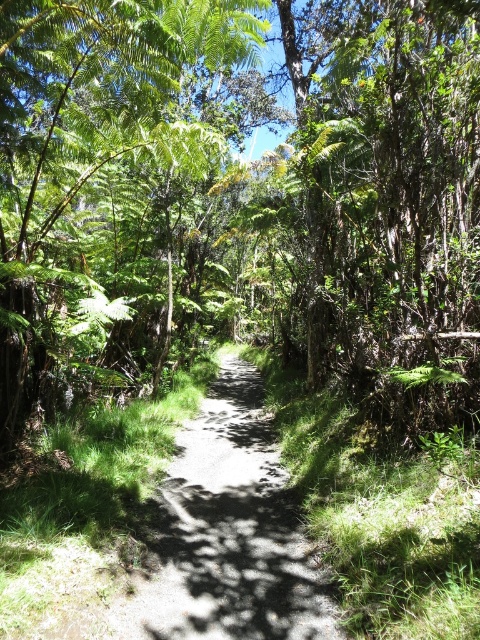
Question: Is green leafy tree at center to the left of dirt path at center from the viewer's perspective?

Choices:
 (A) no
 (B) yes

Answer: (B)

Question: Which object appears closest to the camera in this image?

Choices:
 (A) dirt path at center
 (B) green leafy tree at center

Answer: (A)

Question: Does green leafy tree at center have a larger size compared to dirt path at center?

Choices:
 (A) no
 (B) yes

Answer: (B)

Question: Is green leafy tree at center behind dirt path at center?

Choices:
 (A) yes
 (B) no

Answer: (A)